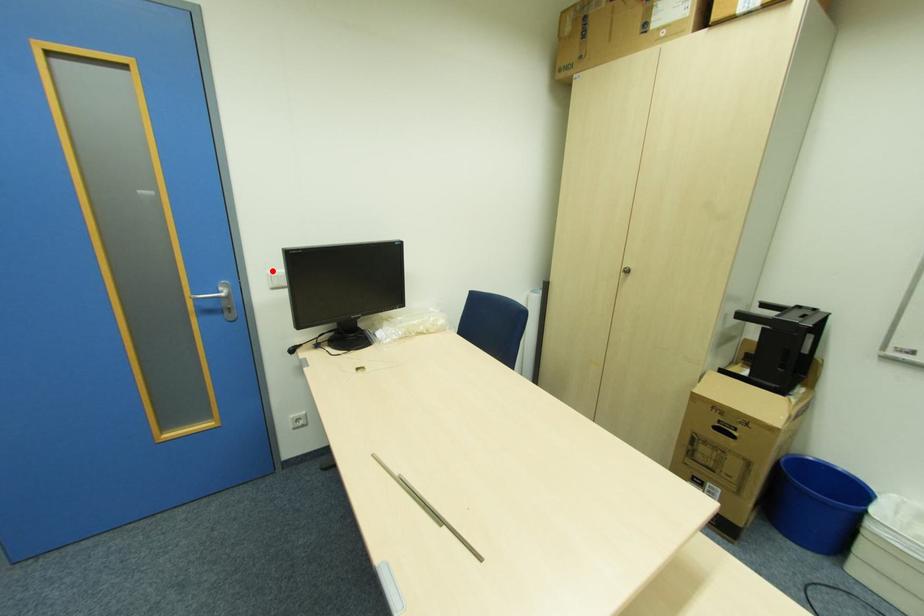
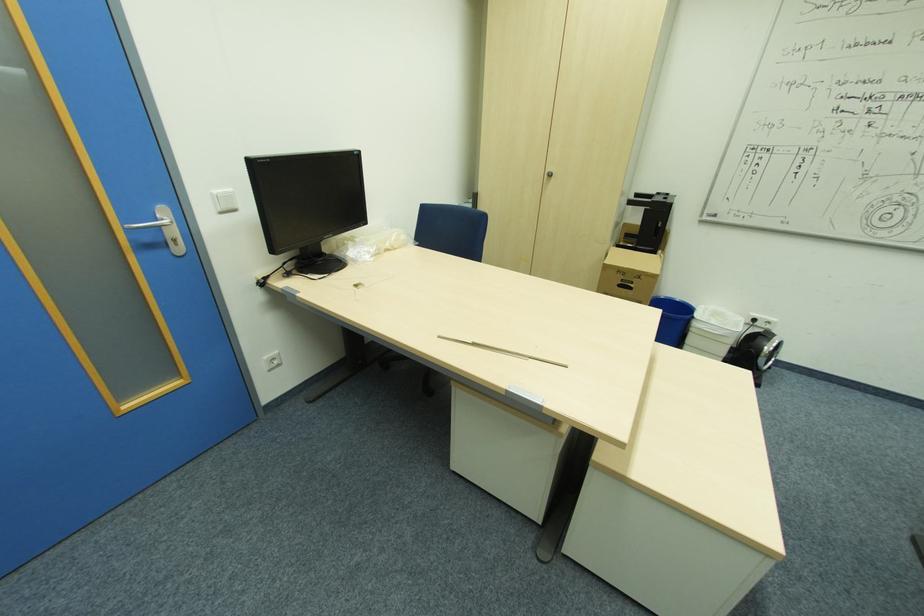
The point at the highlighted location is marked in the first image. Where is the corresponding point in the second image?

(216, 191)